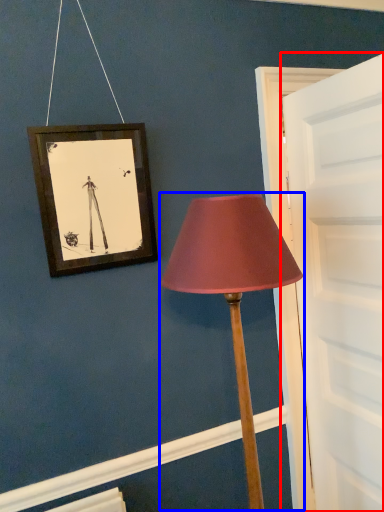
Question: Which object appears farthest to the camera in this image, door (highlighted by a red box) or lamp (highlighted by a blue box)?

Choices:
 (A) door
 (B) lamp

Answer: (A)